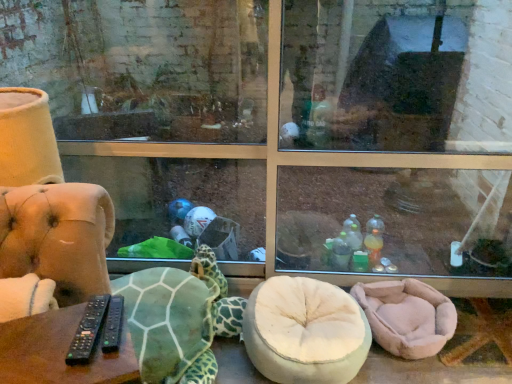
Locate an element on the screen. This screenshot has height=384, width=512. vacant point above black plastic remotes at lower left (from a real-world perspective) is located at coordinates (61, 339).